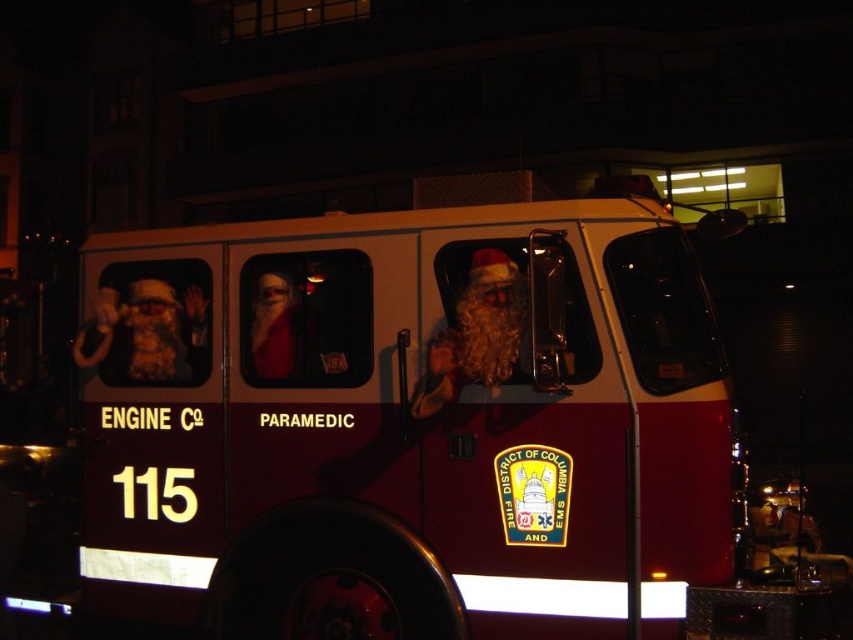
You are a photographer standing in front of the maroon matte fire truck at center and the white fluffy santa at center. You want to take a photo that captures both subjects without any part of them being cut off. Since you can only adjust the camera angle, which subject should you focus on to ensure both are fully visible?

The maroon matte fire truck at center is taller than the white fluffy santa at center. To ensure both are fully visible, focus on the maroon matte fire truck at center as it is the taller subject, allowing the shorter white fluffy santa at center to fit within the frame.